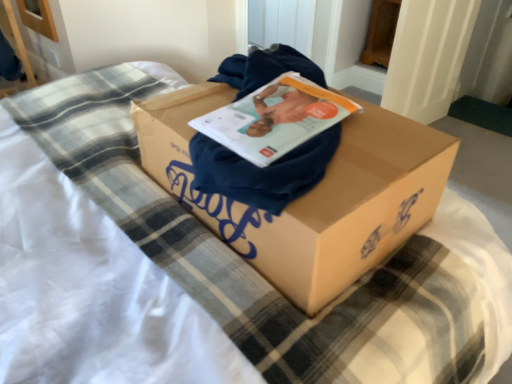
The width and height of the screenshot is (512, 384). What do you see at coordinates (309, 194) in the screenshot?
I see `brown cardboard box at center` at bounding box center [309, 194].

Locate an element on the screen. brown cardboard box at center is located at coordinates (309, 194).

The height and width of the screenshot is (384, 512). In order to click on brown cardboard box at center in this screenshot , I will do `click(309, 194)`.